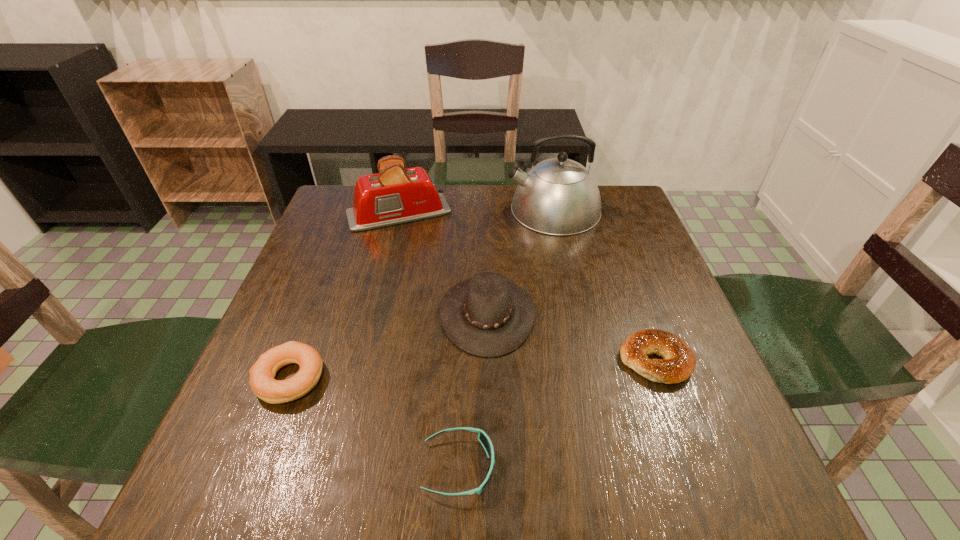
This screenshot has height=540, width=960. In the image, there is a desktop. Find the location of `vacant area at the far right corner`. vacant area at the far right corner is located at coordinates (612, 215).

Image resolution: width=960 pixels, height=540 pixels. Identify the location of empty space between the tallest object and the third tallest object. (520, 262).

This screenshot has height=540, width=960. I want to click on free space between the right bagel and the left bagel, so click(472, 369).

The width and height of the screenshot is (960, 540). Identify the location of free space between the left bagel and the right bagel. (472, 369).

This screenshot has height=540, width=960. What are the coordinates of `empty space between the nearest object and the second tallest object` in the screenshot? It's located at (429, 340).

The width and height of the screenshot is (960, 540). I want to click on free space that is in between the left bagel and the kettle, so click(421, 294).

Locate an element on the screen. This screenshot has width=960, height=540. unoccupied area between the toaster and the left bagel is located at coordinates (345, 296).

Locate an element on the screen. The image size is (960, 540). vacant space that's between the left bagel and the hat is located at coordinates (389, 346).

Locate an element on the screen. This screenshot has width=960, height=540. vacant space that's between the nearest object and the fifth shortest object is located at coordinates [x=429, y=340].

Locate an element on the screen. This screenshot has width=960, height=540. free spot between the right bagel and the second tallest object is located at coordinates (527, 287).